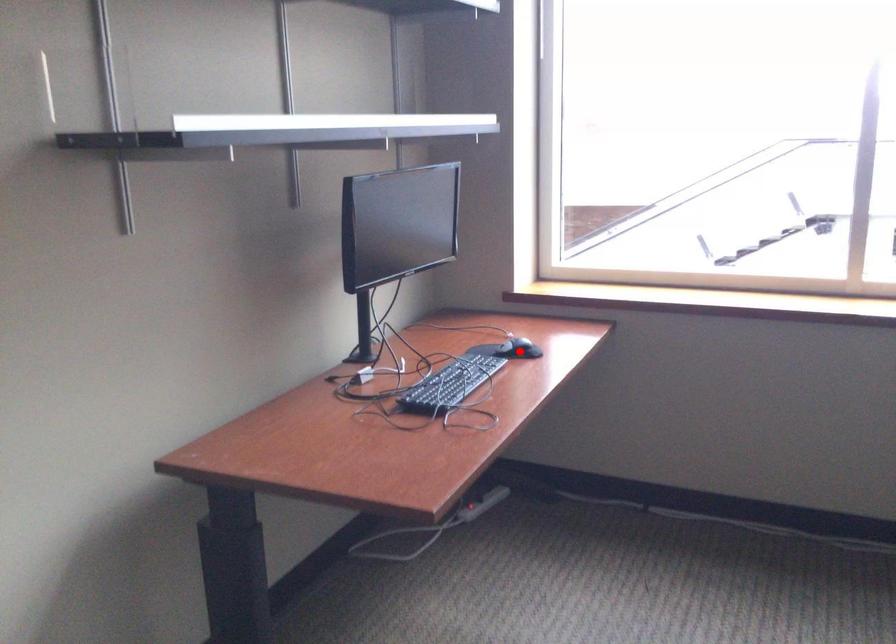
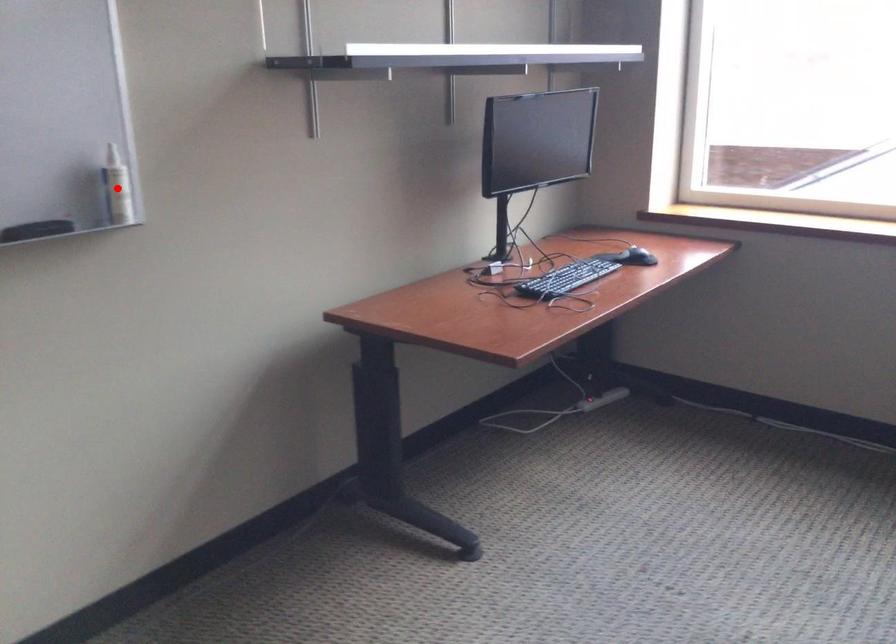
I am providing you with two images of the same scene from different viewpoints. A red point is marked on the first image and another point is marked on the second image. Are the points marked in image1 and image2 representing the same 3D position?

No